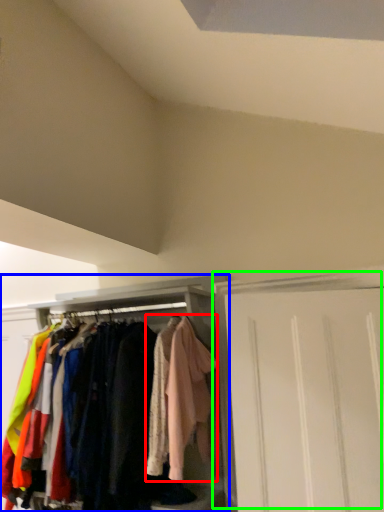
Question: Which is farther away from clothing (highlighted by a red box)? cabinetry (highlighted by a blue box) or door (highlighted by a green box)?

Choices:
 (A) cabinetry
 (B) door

Answer: (B)